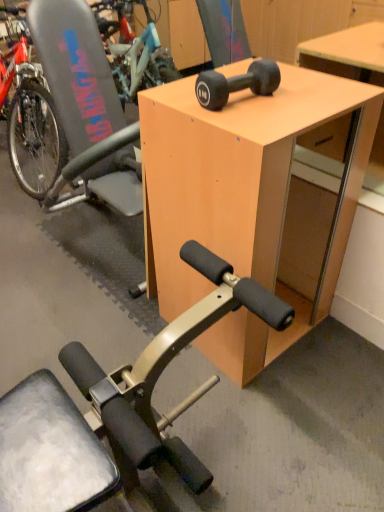
Question: Does black rubber dumbbell at upper center contain gray plastic swivel chair at left?

Choices:
 (A) no
 (B) yes

Answer: (A)

Question: Is black rubber dumbbell at upper center looking in the opposite direction of gray plastic swivel chair at left?

Choices:
 (A) yes
 (B) no

Answer: (B)

Question: Does black rubber dumbbell at upper center turn towards gray plastic swivel chair at left?

Choices:
 (A) yes
 (B) no

Answer: (B)

Question: Considering the relative sizes of black rubber dumbbell at upper center and gray plastic swivel chair at left in the image provided, is black rubber dumbbell at upper center bigger than gray plastic swivel chair at left?

Choices:
 (A) yes
 (B) no

Answer: (B)

Question: From the image's perspective, would you say black rubber dumbbell at upper center is shown under gray plastic swivel chair at left?

Choices:
 (A) no
 (B) yes

Answer: (B)

Question: In terms of width, does black rubber dumbbell at upper center look wider or thinner when compared to light wood desk at center?

Choices:
 (A) wide
 (B) thin

Answer: (B)

Question: From the image's perspective, relative to light wood desk at center, is black rubber dumbbell at upper center above or below?

Choices:
 (A) above
 (B) below

Answer: (A)

Question: Is black rubber dumbbell at upper center spatially inside light wood desk at center, or outside of it?

Choices:
 (A) inside
 (B) outside

Answer: (B)

Question: Is black rubber dumbbell at upper center in front of or behind light wood desk at center in the image?

Choices:
 (A) front
 (B) behind

Answer: (B)

Question: Is gray plastic swivel chair at left bigger or smaller than black rubber dumbbell at upper center?

Choices:
 (A) big
 (B) small

Answer: (A)

Question: Does point (79, 108) appear closer or farther from the camera than point (269, 74)?

Choices:
 (A) farther
 (B) closer

Answer: (A)

Question: Relative to black rubber dumbbell at upper center, is gray plastic swivel chair at left in front or behind?

Choices:
 (A) front
 (B) behind

Answer: (B)

Question: Is gray plastic swivel chair at left to the left or to the right of black rubber dumbbell at upper center in the image?

Choices:
 (A) left
 (B) right

Answer: (A)

Question: In terms of height, does black rubber dumbbell at upper center look taller or shorter compared to gray plastic swivel chair at left?

Choices:
 (A) short
 (B) tall

Answer: (A)

Question: Is black rubber dumbbell at upper center in front of or behind gray plastic swivel chair at left in the image?

Choices:
 (A) front
 (B) behind

Answer: (A)